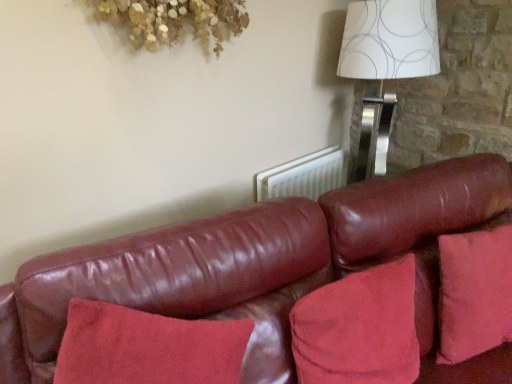
Question: Is leather couch at center aimed at suede-like red pillow at lower right?

Choices:
 (A) yes
 (B) no

Answer: (A)

Question: Is leather couch at center bigger than suede-like red pillow at lower right?

Choices:
 (A) no
 (B) yes

Answer: (B)

Question: Is leather couch at center oriented away from suede-like red pillow at lower right?

Choices:
 (A) no
 (B) yes

Answer: (B)

Question: Is suede-like red pillow at lower right a part of leather couch at center?

Choices:
 (A) yes
 (B) no

Answer: (A)

Question: From the image's perspective, is leather couch at center on top of suede-like red pillow at lower right?

Choices:
 (A) yes
 (B) no

Answer: (B)

Question: Which is correct: suede-like red pillow at lower right is inside leather couch at center, or outside of it?

Choices:
 (A) inside
 (B) outside

Answer: (A)

Question: Based on their positions, is suede-like red pillow at lower right located to the left or right of leather couch at center?

Choices:
 (A) left
 (B) right

Answer: (A)

Question: Is suede-like red pillow at lower right taller or shorter than leather couch at center?

Choices:
 (A) tall
 (B) short

Answer: (B)

Question: Considering their positions, is suede-like red pillow at lower right located in front of or behind leather couch at center?

Choices:
 (A) front
 (B) behind

Answer: (B)

Question: Considering the positions of point (404, 18) and point (358, 377), is point (404, 18) closer or farther from the camera than point (358, 377)?

Choices:
 (A) closer
 (B) farther

Answer: (B)

Question: Based on their positions, is white paper with silver circles at upper right located to the left or right of suede-like red pillow at lower right?

Choices:
 (A) right
 (B) left

Answer: (A)

Question: From a real-world perspective, is white paper with silver circles at upper right positioned above or below suede-like red pillow at lower right?

Choices:
 (A) above
 (B) below

Answer: (A)

Question: From the image's perspective, is white paper with silver circles at upper right above or below suede-like red pillow at lower right?

Choices:
 (A) above
 (B) below

Answer: (A)

Question: Is white paper with silver circles at upper right spatially inside leather couch at center, or outside of it?

Choices:
 (A) inside
 (B) outside

Answer: (B)

Question: Considering the positions of white paper with silver circles at upper right and leather couch at center in the image, is white paper with silver circles at upper right bigger or smaller than leather couch at center?

Choices:
 (A) small
 (B) big

Answer: (A)